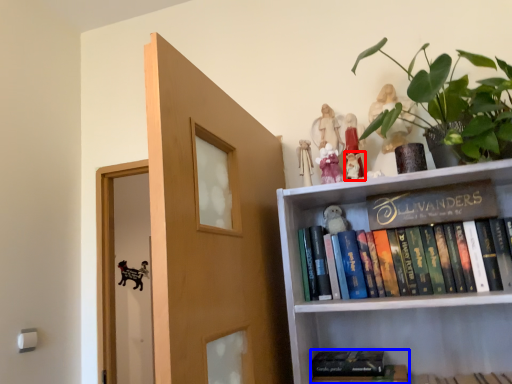
Question: Among these objects, which one is farthest to the camera, toy (highlighted by a red box) or book (highlighted by a blue box)?

Choices:
 (A) toy
 (B) book

Answer: (A)